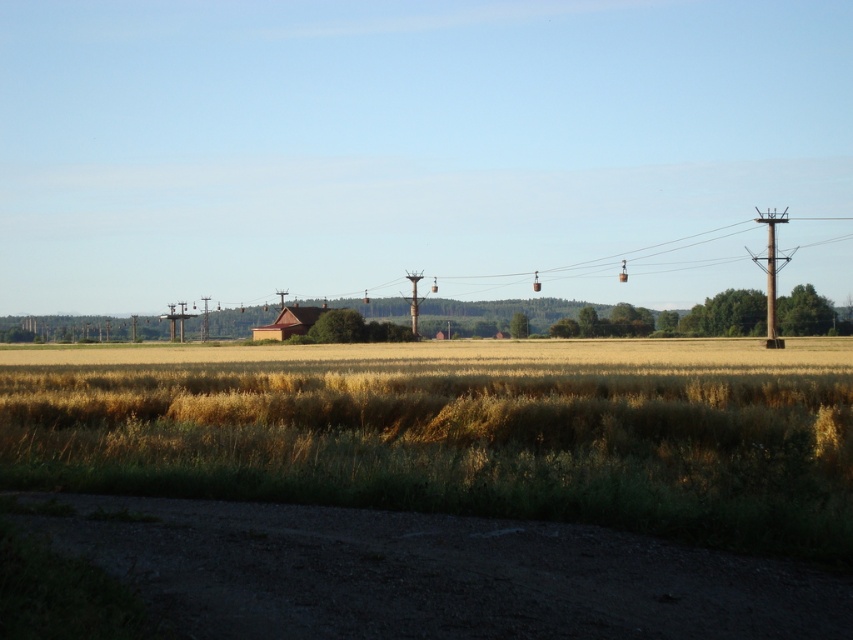
Question: From the image, what is the correct spatial relationship of yellow grassy wheat field at center in relation to metallic gray telegraph pole at center?

Choices:
 (A) right
 (B) left

Answer: (A)

Question: Can you confirm if yellow grassy wheat field at center is bigger than brown wooden telegraph pole at right?

Choices:
 (A) yes
 (B) no

Answer: (B)

Question: Considering the real-world distances, which object is closest to the metallic gray telegraph pole at center?

Choices:
 (A) brown wooden hut at center
 (B) yellow grassy wheat field at center
 (C) brown wooden telegraph pole at right

Answer: (A)

Question: Can you confirm if brown wooden hut at center is positioned below metallic gray telegraph pole at center?

Choices:
 (A) yes
 (B) no

Answer: (A)

Question: Among these objects, which one is farthest from the camera?

Choices:
 (A) yellow grassy wheat field at center
 (B) metallic gray telegraph pole at center
 (C) brown wooden hut at center
 (D) brown wooden telegraph pole at right

Answer: (B)

Question: Considering the real-world distances, which object is farthest from the brown wooden hut at center?

Choices:
 (A) yellow grassy wheat field at center
 (B) brown wooden telegraph pole at right
 (C) metallic gray telegraph pole at center

Answer: (B)